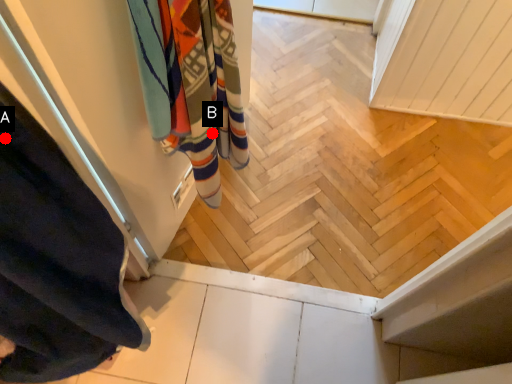
Question: Two points are circled on the image, labeled by A and B beside each circle. Which point is closer to the camera?

Choices:
 (A) A is closer
 (B) B is closer

Answer: (A)